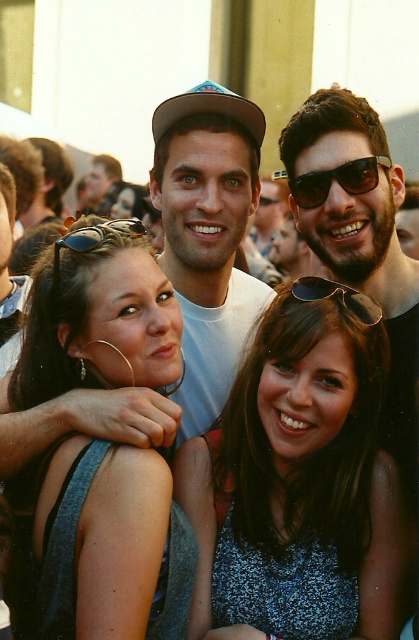
Question: Does matte gray tank top at center have a lesser width compared to sunglasses at center?

Choices:
 (A) no
 (B) yes

Answer: (A)

Question: Does sparkly blue dress at center appear on the right side of white t-shirt at center?

Choices:
 (A) no
 (B) yes

Answer: (B)

Question: Which point is farther from the camera taking this photo?

Choices:
 (A) (351, 289)
 (B) (405, 538)
 (C) (328, 192)

Answer: (C)

Question: Which point is farther to the camera?

Choices:
 (A) sunglasses at upper center
 (B) sparkly blue dress at center
 (C) matte gray tank top at center

Answer: (A)

Question: Is matte gray tank top at center above white t-shirt at center?

Choices:
 (A) yes
 (B) no

Answer: (B)

Question: Among these objects, which one is nearest to the camera?

Choices:
 (A) white t-shirt at center
 (B) matte gray tank top at center
 (C) sparkly blue dress at center
 (D) black plastic sunglasses at center

Answer: (B)